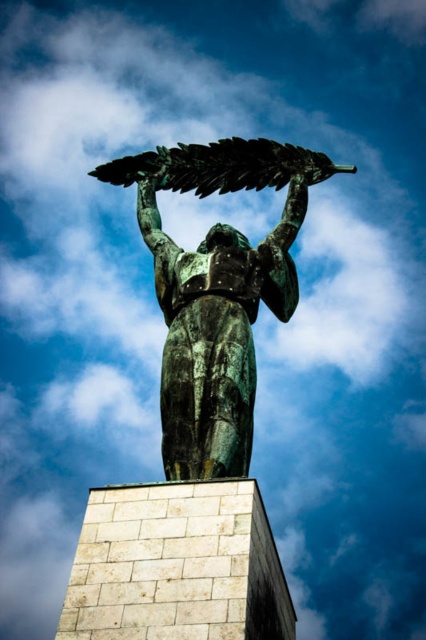
Question: Which of the following is the farthest from the observer?

Choices:
 (A) (216, 179)
 (B) (192, 476)

Answer: (A)

Question: Can you confirm if bronze statue at center is bigger than green patina leaf at upper center?

Choices:
 (A) no
 (B) yes

Answer: (B)

Question: Is bronze statue at center to the right of green patina leaf at upper center from the viewer's perspective?

Choices:
 (A) yes
 (B) no

Answer: (B)

Question: Which point is farther to the camera?

Choices:
 (A) bronze statue at center
 (B) green patina leaf at upper center

Answer: (B)

Question: Does bronze statue at center appear under green patina leaf at upper center?

Choices:
 (A) yes
 (B) no

Answer: (A)